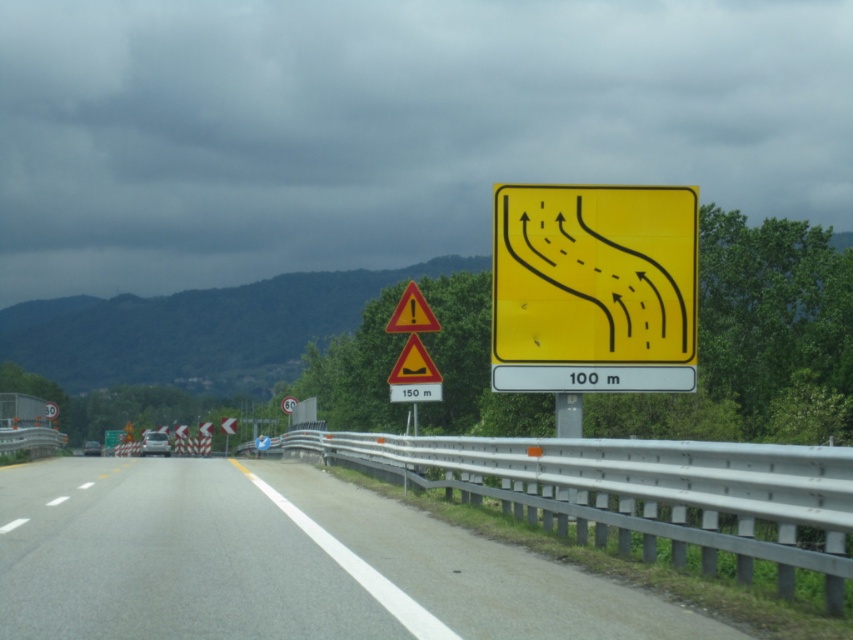
Is gray asphalt road at center above yellow plastic road sign at upper right?

No.

Does gray asphalt road at center have a smaller size compared to yellow plastic road sign at upper right?

No.

Between point (73, 531) and point (577, 289), which one is positioned behind?

The point (577, 289) is more distant.

What are the coordinates of `gray asphalt road at center` in the screenshot? It's located at (280, 563).